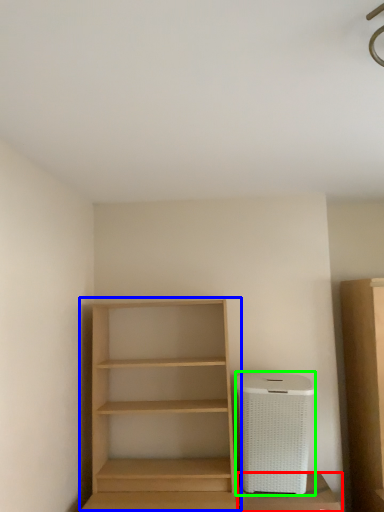
Question: Which is nearer to the cabinetry (highlighted by a red box)? shelf (highlighted by a blue box) or appliance (highlighted by a green box).

Choices:
 (A) shelf
 (B) appliance

Answer: (B)